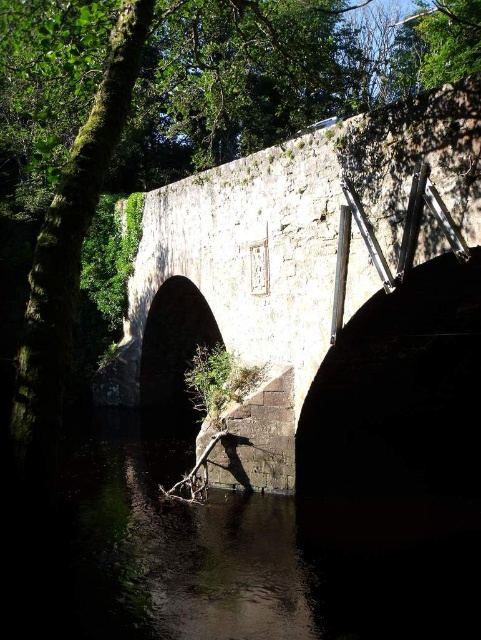
Question: Can you confirm if dark stone water at lower center is thinner than stone bridge at center?

Choices:
 (A) yes
 (B) no

Answer: (A)

Question: Can you confirm if dark stone water at lower center is positioned below stone bridge at center?

Choices:
 (A) yes
 (B) no

Answer: (A)

Question: Which object is farther from the camera taking this photo?

Choices:
 (A) dark stone water at lower center
 (B) stone bridge at center

Answer: (B)

Question: Which point is farther from the camera taking this photo?

Choices:
 (A) (325, 186)
 (B) (304, 564)

Answer: (A)

Question: Does dark stone water at lower center appear on the left side of stone bridge at center?

Choices:
 (A) yes
 (B) no

Answer: (A)